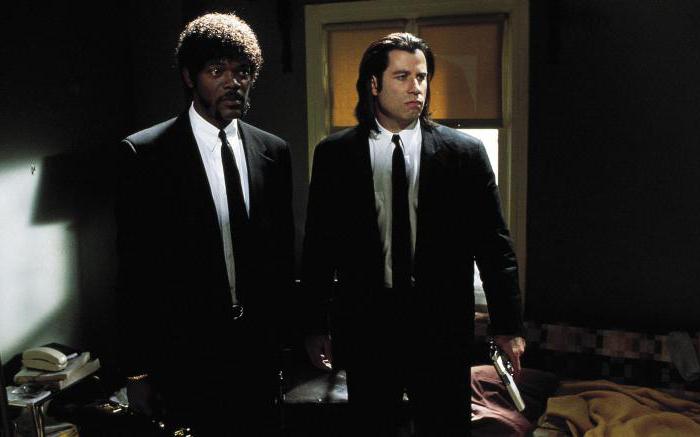
This screenshot has height=437, width=700. Identify the location of blankets. (603, 403), (505, 420).